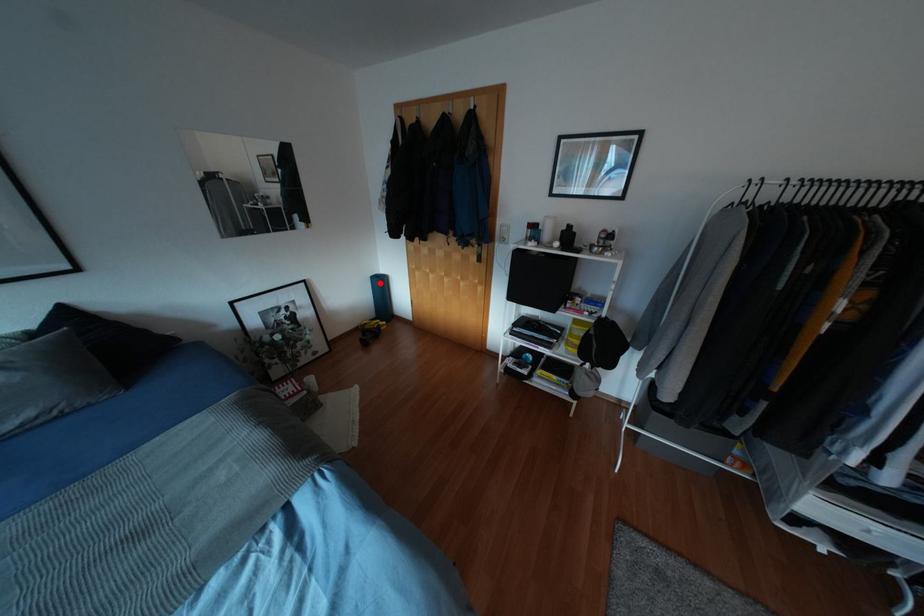
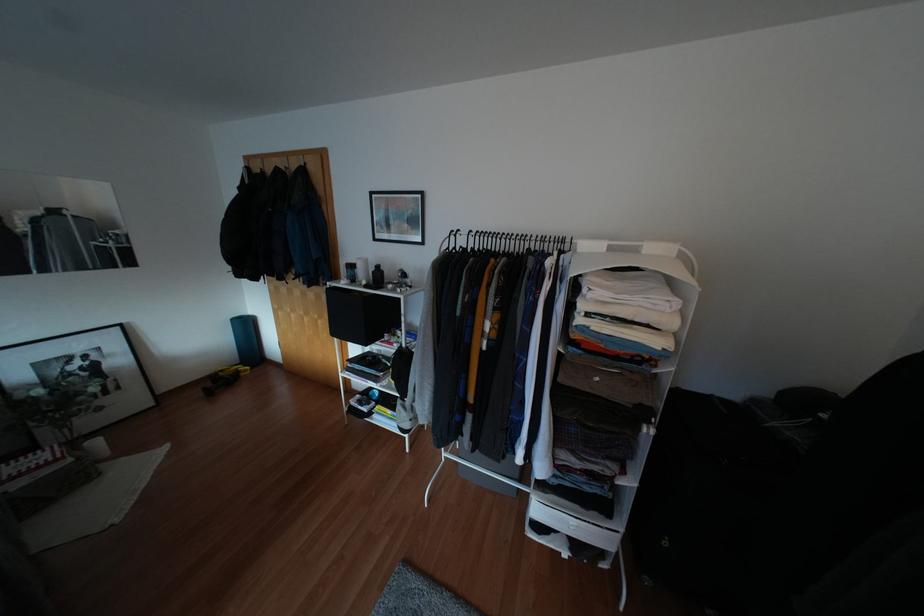
Question: I am providing you with two images of the same scene from different viewpoints. A red point is shown in image1. For the corresponding object point in image2, is it positioned nearer or farther from the camera?

Choices:
 (A) Nearer
 (B) Farther

Answer: (B)